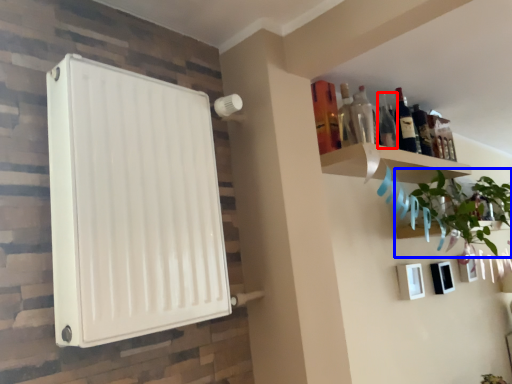
Question: Which point is further to the camera, bottle (highlighted by a red box) or houseplant (highlighted by a blue box)?

Choices:
 (A) bottle
 (B) houseplant

Answer: (A)